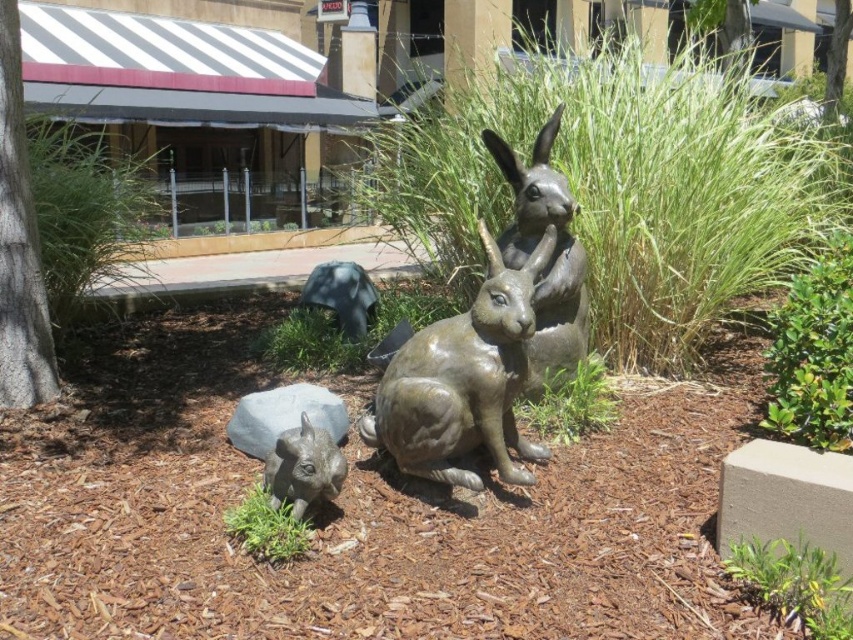
Is bronze rabbit at center further to camera compared to bronze statue at center?

That is False.

Is point (460, 353) positioned behind point (550, 381)?

No, (460, 353) is in front of (550, 381).

The width and height of the screenshot is (853, 640). Identify the location of bronze rabbit at center. (463, 380).

Which is behind, point (430, 420) or point (317, 484)?

Point (430, 420)

Who is shorter, bronze rabbit at center or satin gray rabbit at lower left?

satin gray rabbit at lower left

Is point (415, 404) less distant than point (265, 481)?

No.

At what (x,y) coordinates should I click in order to perform the action: click on bronze rabbit at center. Please return your answer as a coordinate pair (x, y). Image resolution: width=853 pixels, height=640 pixels. Looking at the image, I should click on (463, 380).

Looking at this image, which is below, bronze statue at center or satin gray rabbit at lower left?

satin gray rabbit at lower left is lower down.

Between point (541, 176) and point (311, 424), which one is positioned in front?

Positioned in front is point (311, 424).

Where is `bronze statue at center`? This screenshot has height=640, width=853. bronze statue at center is located at coordinates (549, 259).